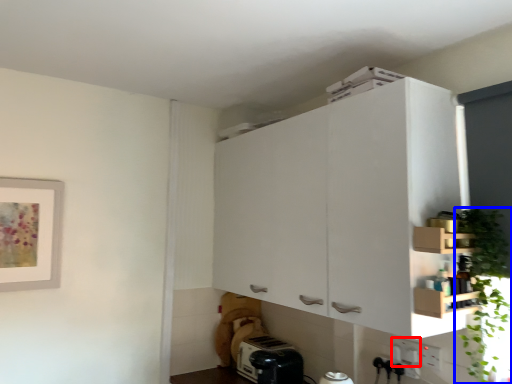
Question: Which point is closer to the camera, electric outlet (highlighted by a red box) or plant (highlighted by a blue box)?

Choices:
 (A) electric outlet
 (B) plant

Answer: (B)